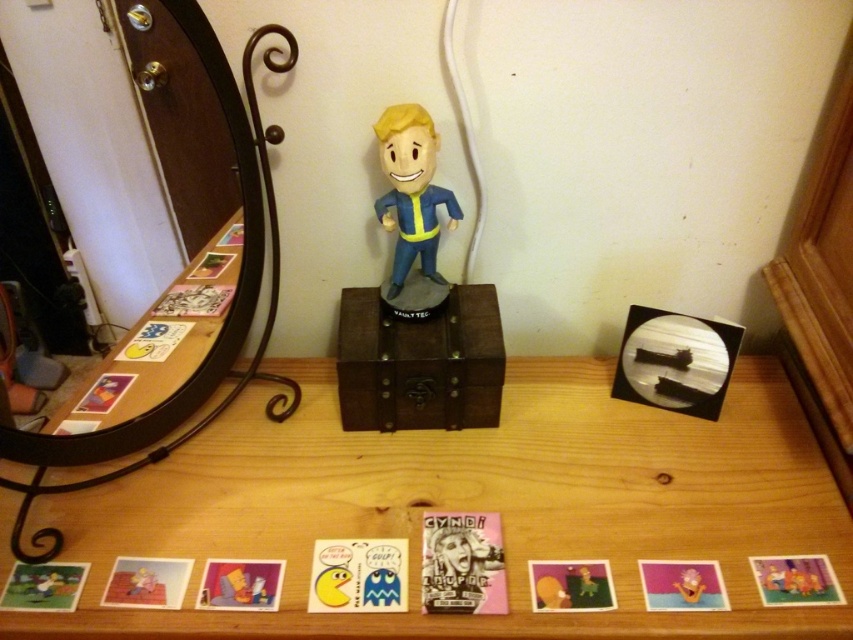
Question: Which object appears closest to the camera in this image?

Choices:
 (A) wooden table at center
 (B) matte plastic bobblehead at center

Answer: (A)

Question: Which point is farther from the camera taking this photo?

Choices:
 (A) (485, 339)
 (B) (277, 65)
 (C) (549, 461)

Answer: (C)

Question: Does wooden table at center appear over black glass mirror at left?

Choices:
 (A) yes
 (B) no

Answer: (B)

Question: Which of the following is the closest to the observer?

Choices:
 (A) (59, 534)
 (B) (370, 317)
 (C) (672, 620)

Answer: (C)

Question: From the image, what is the correct spatial relationship of brown wooden chest at center in relation to black glass mirror at left?

Choices:
 (A) above
 (B) below

Answer: (B)

Question: Is wooden table at center positioned in front of brown wooden chest at center?

Choices:
 (A) yes
 (B) no

Answer: (A)